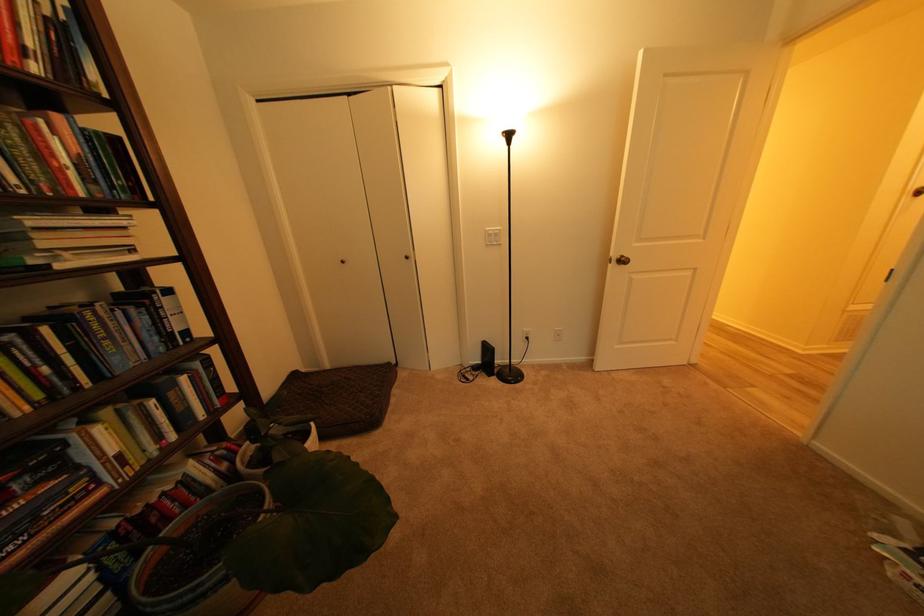
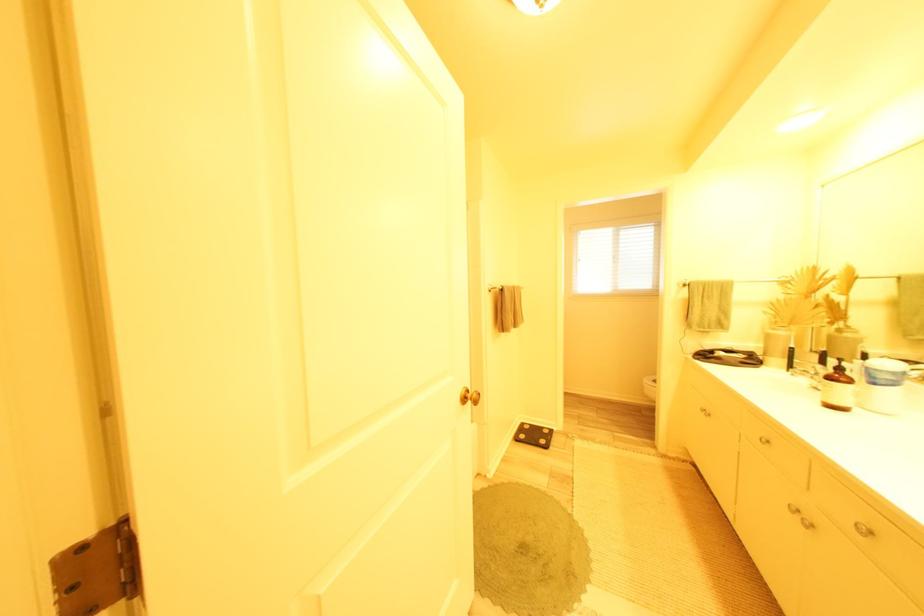
Question: I am providing you with two images of the same scene from different viewpoints. Which of the following objects are not visible in image2?

Choices:
 (A) green bottle pump
 (B) small green plate
 (C) book
 (D) black floor scale

Answer: (C)